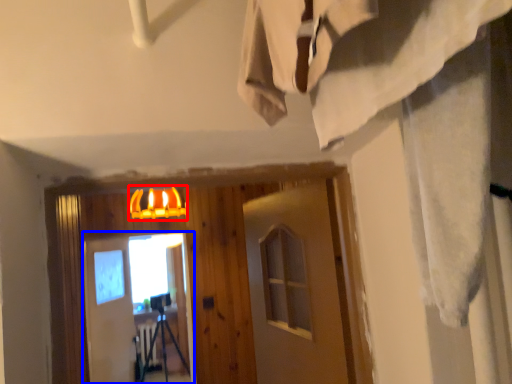
Question: Among these objects, which one is farthest to the camera, lamp (highlighted by a red box) or screen door (highlighted by a blue box)?

Choices:
 (A) lamp
 (B) screen door

Answer: (B)